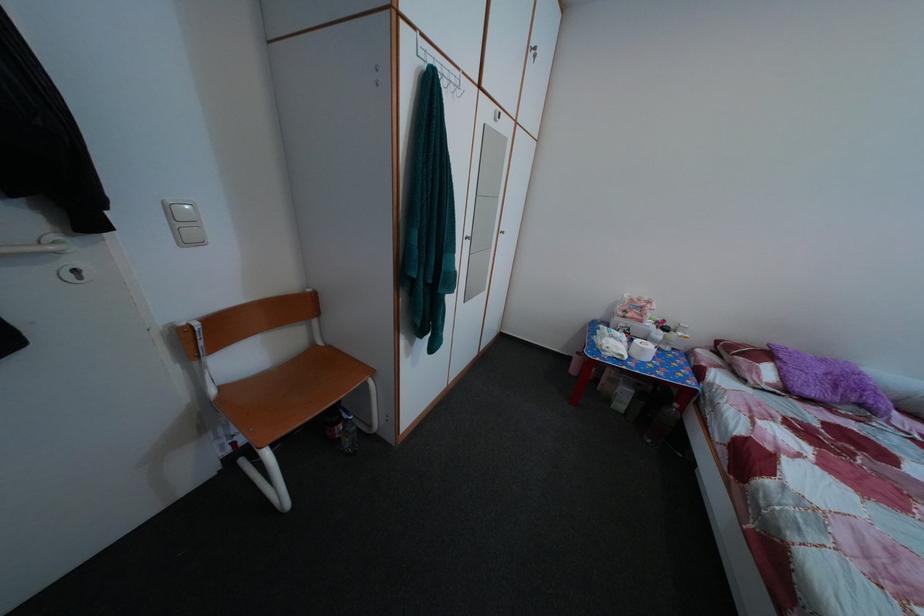
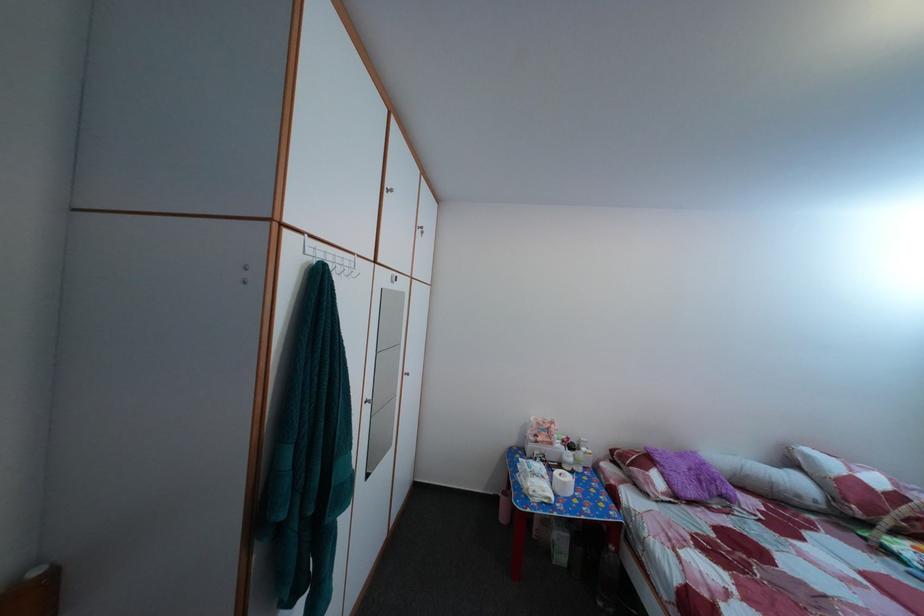
Find the pixel in the second image that matches point 674,329 in the first image.

(578, 447)